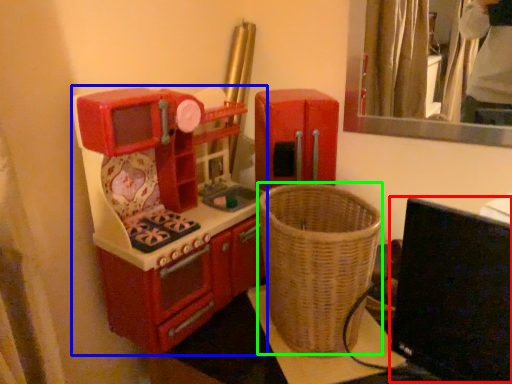
Question: Which object is the farthest from computer monitor (highlighted by a red box)? Choose among these: appliance (highlighted by a blue box) or basket (highlighted by a green box).

Choices:
 (A) appliance
 (B) basket

Answer: (A)